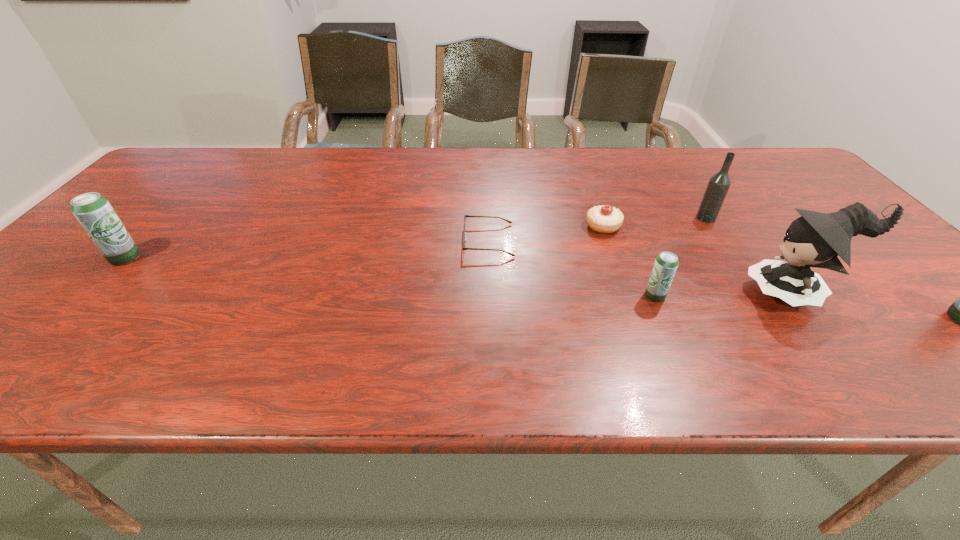
This screenshot has height=540, width=960. Find the location of `vacant area that satisfies the following two spatial constraints: 1. on the front-facing side of the spectacles; 2. on the left side of the shortest beer can`. vacant area that satisfies the following two spatial constraints: 1. on the front-facing side of the spectacles; 2. on the left side of the shortest beer can is located at coordinates (490, 296).

Identify the location of free region that satisfies the following two spatial constraints: 1. on the back side of the leftmost beer can; 2. on the left side of the pastry. (155, 226).

Image resolution: width=960 pixels, height=540 pixels. I want to click on vacant space that satisfies the following two spatial constraints: 1. at the face of the doll; 2. on the front side of the second beer can from right to left, so click(x=797, y=296).